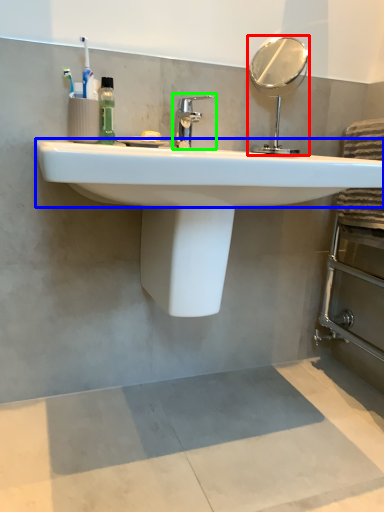
Question: Which object is positioned closest to mirror (highlighted by a red box)? Select from counter top (highlighted by a blue box) and tap (highlighted by a green box).

Choices:
 (A) counter top
 (B) tap

Answer: (B)